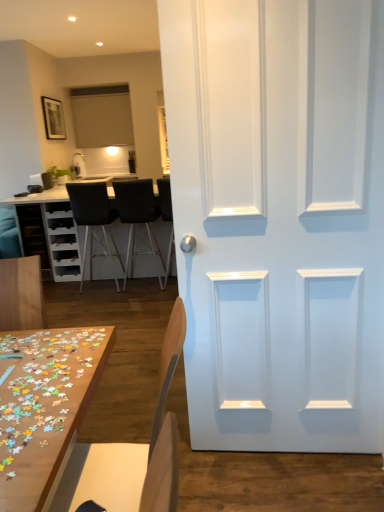
Question: From a real-world perspective, is black leather chair at center, acting as the 1th chair starting from the back, on black leather chair at center, which ranks as the third chair in back-to-front order?

Choices:
 (A) yes
 (B) no

Answer: (B)

Question: Would you say black leather chair at center, acting as the 1th chair starting from the back, contains black leather chair at center, the 2th chair when ordered from front to back?

Choices:
 (A) yes
 (B) no

Answer: (B)

Question: Is black leather chair at center, acting as the 1th chair starting from the back, positioned far away from black leather chair at center, the 2th chair when ordered from front to back?

Choices:
 (A) no
 (B) yes

Answer: (A)

Question: Can you confirm if black leather chair at center, acting as the 1th chair starting from the back, is taller than black leather chair at center, the 2th chair when ordered from front to back?

Choices:
 (A) yes
 (B) no

Answer: (A)

Question: Is black leather chair at center, acting as the 1th chair starting from the back, in contact with black leather chair at center, the 2th chair when ordered from front to back?

Choices:
 (A) yes
 (B) no

Answer: (B)

Question: In terms of width, does light brown wood chair at lower center, which is counted as the 4th chair, starting from the back, look wider or thinner when compared to matte black cabinet at left?

Choices:
 (A) wide
 (B) thin

Answer: (A)

Question: From the image's perspective, relative to matte black cabinet at left, is light brown wood chair at lower center, which is counted as the 1th chair, starting from the front, above or below?

Choices:
 (A) below
 (B) above

Answer: (A)

Question: Considering the relative positions of light brown wood chair at lower center, which is counted as the 1th chair, starting from the front, and matte black cabinet at left in the image provided, is light brown wood chair at lower center, which is counted as the 1th chair, starting from the front, to the left or to the right of matte black cabinet at left?

Choices:
 (A) right
 (B) left

Answer: (A)

Question: In terms of height, does light brown wood chair at lower center, which is counted as the 1th chair, starting from the front, look taller or shorter compared to matte black cabinet at left?

Choices:
 (A) short
 (B) tall

Answer: (B)

Question: From the image's perspective, is black fabric chair at center, arranged as the third chair when viewed from the front, located above or below black leather chair at center, marked as the 4th chair in a front-to-back arrangement?

Choices:
 (A) above
 (B) below

Answer: (A)

Question: Is black fabric chair at center, arranged as the third chair when viewed from the front, spatially inside black leather chair at center, acting as the 1th chair starting from the back, or outside of it?

Choices:
 (A) outside
 (B) inside

Answer: (A)

Question: From a real-world perspective, is black fabric chair at center, acting as the second chair starting from the back, above or below black leather chair at center, marked as the 4th chair in a front-to-back arrangement?

Choices:
 (A) above
 (B) below

Answer: (B)

Question: Is black fabric chair at center, acting as the second chair starting from the back, to the left or to the right of black leather chair at center, marked as the 4th chair in a front-to-back arrangement, in the image?

Choices:
 (A) left
 (B) right

Answer: (B)

Question: Is matte black cabinet at left in front of or behind white matte door at center in the image?

Choices:
 (A) front
 (B) behind

Answer: (B)

Question: In terms of size, does matte black cabinet at left appear bigger or smaller than white matte door at center?

Choices:
 (A) big
 (B) small

Answer: (B)